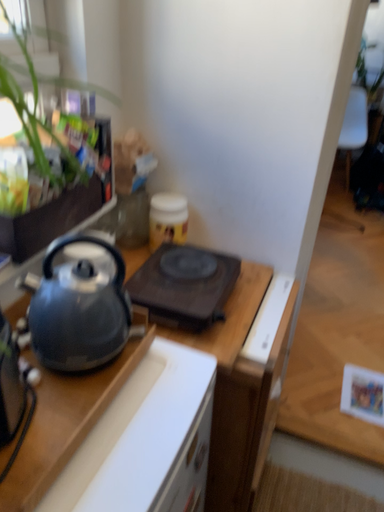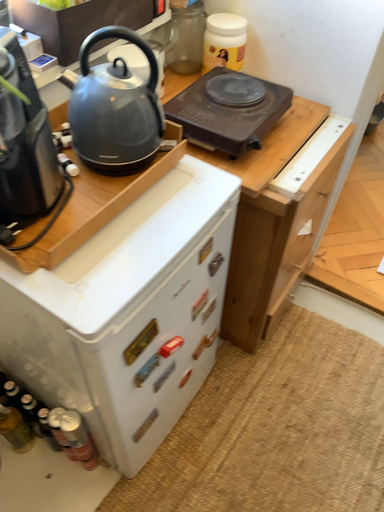
Question: How did the camera likely rotate when shooting the video?

Choices:
 (A) rotated upward
 (B) rotated downward

Answer: (B)